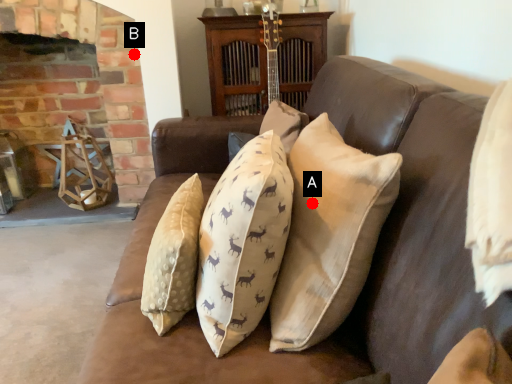
Question: Two points are circled on the image, labeled by A and B beside each circle. Which of the following is the farthest from the observer?

Choices:
 (A) A is further
 (B) B is further

Answer: (B)